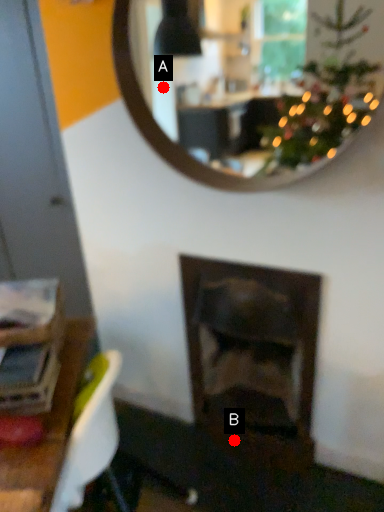
Question: Two points are circled on the image, labeled by A and B beside each circle. Which point is closer to the camera taking this photo?

Choices:
 (A) A is closer
 (B) B is closer

Answer: (A)